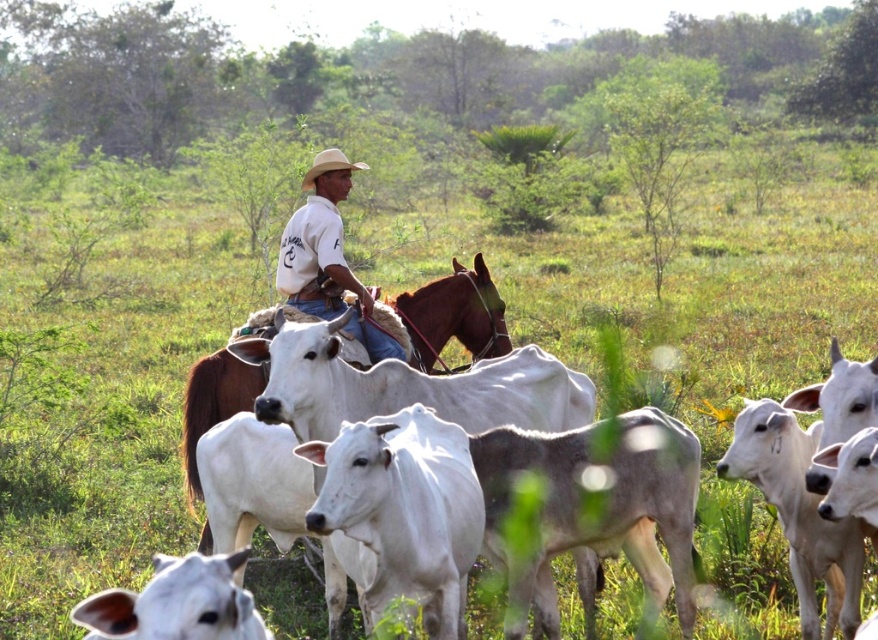
You are a photographer trying to capture the man in the scene. You notice the white cotton shirt at center and the light brown straw cowboy hat at center. Which object should you focus on to ensure the man is fully visible in your photo?

The white cotton shirt at center is in front of the light brown straw cowboy hat at center, so focusing on the white cotton shirt at center will ensure the man is fully visible.

Consider the image. You are a photographer trying to capture the scene of the man herding cattle. You notice the brown leather horse at center and the light brown straw cowboy hat at center. Which object is wider in the image?

The light brown straw cowboy hat at center is wider than the brown leather horse at center in the image.